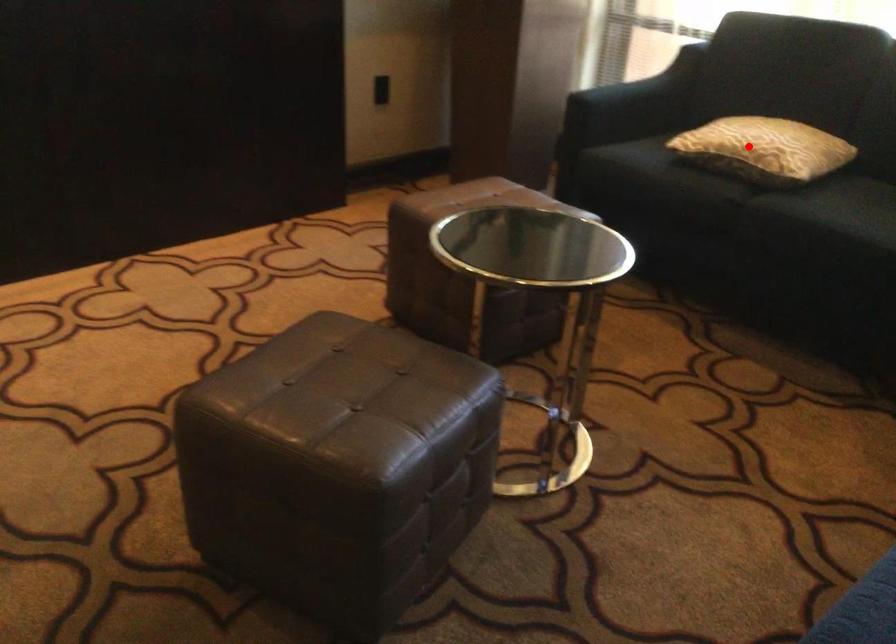
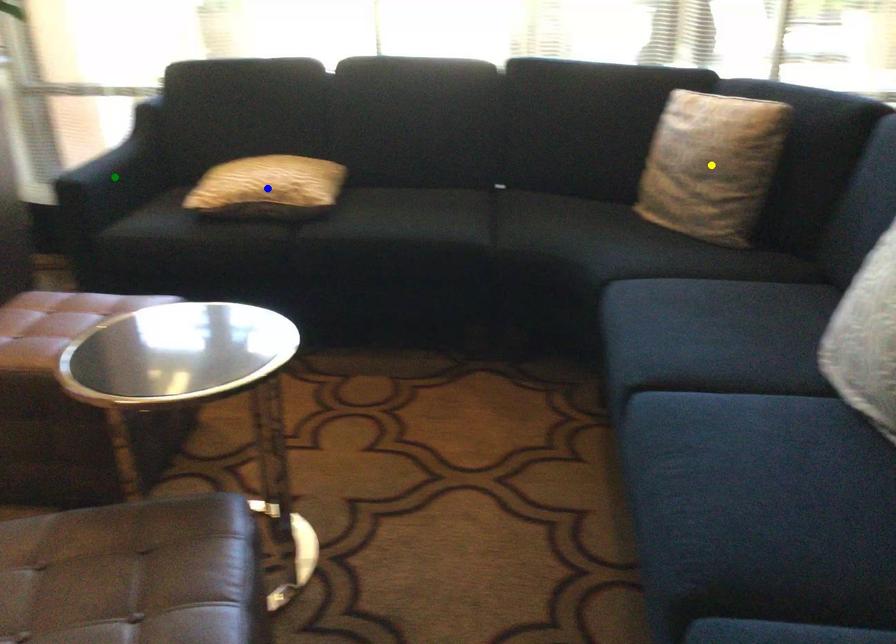
Question: I am providing you with two images of the same scene from different viewpoints. A red point is marked on the first image. You are given multiple points on the second image. Which spot in image 2 lines up with the point in image 1?

Choices:
 (A) green point
 (B) yellow point
 (C) blue point

Answer: (C)